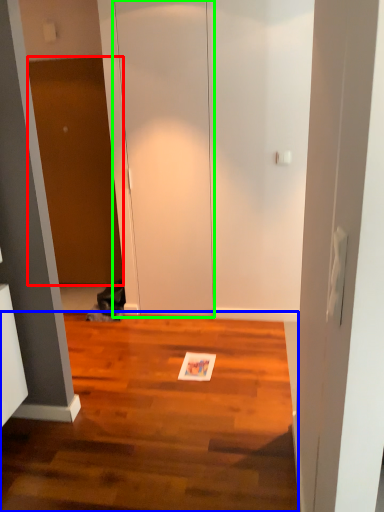
Question: Which object is positioned farthest from door (highlighted by a red box)? Select from hardwood (highlighted by a blue box) and glass door (highlighted by a green box).

Choices:
 (A) hardwood
 (B) glass door

Answer: (A)